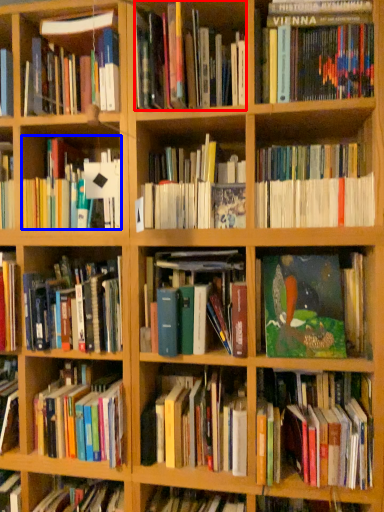
Question: Which point is further to the camera, book (highlighted by a red box) or book (highlighted by a blue box)?

Choices:
 (A) book
 (B) book

Answer: (B)